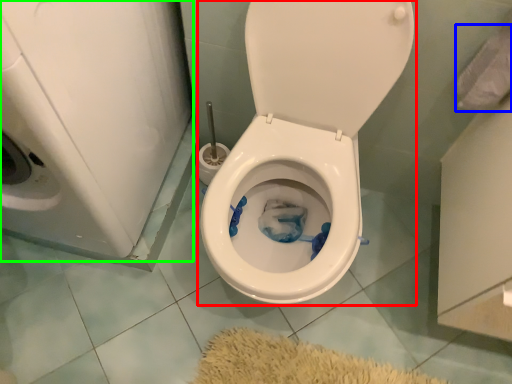
Question: Estimate the real-world distances between objects in this image. Which object is farther from toilet (highlighted by a red box), toilet paper (highlighted by a blue box) or washer (highlighted by a green box)?

Choices:
 (A) toilet paper
 (B) washer

Answer: (A)